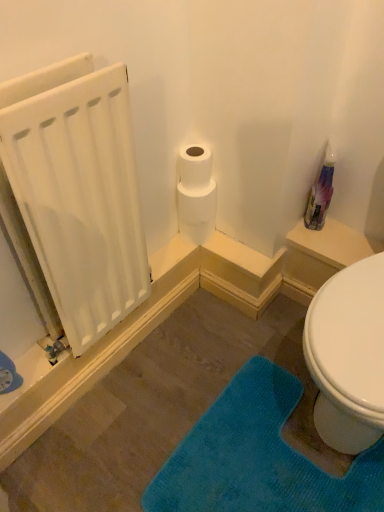
The width and height of the screenshot is (384, 512). Find the location of `teal plush bath mat at lower right`. teal plush bath mat at lower right is located at coordinates [258, 457].

Describe the element at coordinates (196, 211) in the screenshot. I see `white matte toilet paper at upper center` at that location.

Image resolution: width=384 pixels, height=512 pixels. What do you see at coordinates (80, 198) in the screenshot? I see `white matte radiator at left` at bounding box center [80, 198].

Image resolution: width=384 pixels, height=512 pixels. What are the coordinates of `teal plush bath mat at lower right` in the screenshot? It's located at (258, 457).

Who is shorter, teal plush bath mat at lower right or white matte radiator at left?

Standing shorter between the two is teal plush bath mat at lower right.

Is teal plush bath mat at lower right oriented away from white matte radiator at left?

teal plush bath mat at lower right does not have its back to white matte radiator at left.

Locate an element on the screen. Image resolution: width=384 pixels, height=512 pixels. radiator in front of the teal plush bath mat at lower right is located at coordinates (80, 198).

Is point (210, 424) closer to camera compared to point (132, 255)?

No.

Considering the sizes of objects translucent plastic spray bottle at upper right and white matte radiator at left in the image provided, who is taller, translucent plastic spray bottle at upper right or white matte radiator at left?

Standing taller between the two is white matte radiator at left.

Can you confirm if translucent plastic spray bottle at upper right is smaller than white matte radiator at left?

Yes.

Between translucent plastic spray bottle at upper right and white matte radiator at left, which one is positioned in front?

white matte radiator at left is more forward.

Is translucent plastic spray bottle at upper right placed right next to white matte radiator at left?

No, translucent plastic spray bottle at upper right is not touching white matte radiator at left.

Which is more distant, (x=86, y=161) or (x=320, y=218)?

The point (x=320, y=218) is farther from the camera.

From a real-world perspective, is white matte radiator at left on top of translucent plastic spray bottle at upper right?

Indeed, from a real-world perspective, white matte radiator at left stands above translucent plastic spray bottle at upper right.

Is white matte radiator at left bigger or smaller than translucent plastic spray bottle at upper right?

Considering their sizes, white matte radiator at left takes up more space than translucent plastic spray bottle at upper right.

Who is shorter, translucent plastic spray bottle at upper right or white matte toilet paper at upper center?

Standing shorter between the two is white matte toilet paper at upper center.

Is point (323, 192) closer or farther from the camera than point (204, 212)?

Point (323, 192) is positioned closer to the camera compared to point (204, 212).

Does translucent plastic spray bottle at upper right have a smaller size compared to white matte toilet paper at upper center?

Yes, translucent plastic spray bottle at upper right is smaller than white matte toilet paper at upper center.

From the image's perspective, is translucent plastic spray bottle at upper right beneath white matte toilet paper at upper center?

No, from the image's perspective, translucent plastic spray bottle at upper right is not beneath white matte toilet paper at upper center.

How different are the orientations of white matte radiator at left and white matte toilet paper at upper center in degrees?

The facing directions of white matte radiator at left and white matte toilet paper at upper center are 0.00369 degrees apart.

From a real-world perspective, is white matte radiator at left on top of white matte toilet paper at upper center?

Yes, from a real-world perspective, white matte radiator at left is above white matte toilet paper at upper center.

Is white matte radiator at left turned away from white matte toilet paper at upper center?

No, white matte radiator at left is not facing the opposite direction of white matte toilet paper at upper center.

Considering the points (49, 218) and (208, 222), which point is behind, point (49, 218) or point (208, 222)?

Positioned behind is point (208, 222).

Is white matte radiator at left taller or shorter than teal plush bath mat at lower right?

Clearly, white matte radiator at left is taller compared to teal plush bath mat at lower right.

Who is more distant, white matte radiator at left or teal plush bath mat at lower right?

Positioned behind is teal plush bath mat at lower right.

Considering the relative sizes of white matte radiator at left and teal plush bath mat at lower right in the image provided, is white matte radiator at left wider than teal plush bath mat at lower right?

Incorrect, the width of white matte radiator at left does not surpass that of teal plush bath mat at lower right.

Is white matte radiator at left positioned with its back to teal plush bath mat at lower right?

No, white matte radiator at left is not facing the opposite direction of teal plush bath mat at lower right.

From the image's perspective, which one is positioned higher, white matte toilet paper at upper center or teal plush bath mat at lower right?

white matte toilet paper at upper center, from the image's perspective.

Considering the sizes of white matte toilet paper at upper center and teal plush bath mat at lower right in the image, is white matte toilet paper at upper center wider or thinner than teal plush bath mat at lower right?

white matte toilet paper at upper center is thinner than teal plush bath mat at lower right.

Would you say teal plush bath mat at lower right is part of white matte toilet paper at upper center's contents?

No, teal plush bath mat at lower right is not inside white matte toilet paper at upper center.

Are white matte toilet paper at upper center and teal plush bath mat at lower right far apart?

That's not correct — white matte toilet paper at upper center is a little close to teal plush bath mat at lower right.

I want to click on bath mat on the right of the white matte radiator at left, so click(x=258, y=457).

You are a GUI agent. You are given a task and a screenshot of the screen. Output one action in this format:
    pyautogui.click(x=<x>, y=<y>)
    Task: Click on the cleaning product below the white matte radiator at left (from a real-world perspective)
    The image size is (384, 512).
    Given the screenshot: What is the action you would take?
    pyautogui.click(x=320, y=192)

Looking at this image, estimate the real-world distances between objects in this image. Which object is further from teal plush bath mat at lower right, white matte radiator at left or white matte toilet paper at upper center?

white matte toilet paper at upper center lies further to teal plush bath mat at lower right than the other object.

From the image, which object appears to be nearer to translucent plastic spray bottle at upper right, white matte radiator at left or teal plush bath mat at lower right?

Based on the image, teal plush bath mat at lower right appears to be nearer to translucent plastic spray bottle at upper right.

From the image, which object appears to be farther from white matte toilet paper at upper center, teal plush bath mat at lower right or white matte radiator at left?

Among the two, teal plush bath mat at lower right is located further to white matte toilet paper at upper center.

Based on their spatial positions, is white matte toilet paper at upper center or white matte radiator at left closer to teal plush bath mat at lower right?

white matte radiator at left lies closer to teal plush bath mat at lower right than the other object.

Considering their positions, is teal plush bath mat at lower right positioned further to white matte radiator at left than translucent plastic spray bottle at upper right?

Based on the image, translucent plastic spray bottle at upper right appears to be further to white matte radiator at left.

Estimate the real-world distances between objects in this image. Which object is closer to teal plush bath mat at lower right, translucent plastic spray bottle at upper right or white matte toilet paper at upper center?

Based on the image, white matte toilet paper at upper center appears to be nearer to teal plush bath mat at lower right.

Based on their spatial positions, is white matte radiator at left or translucent plastic spray bottle at upper right closer to teal plush bath mat at lower right?

white matte radiator at left.

Estimate the real-world distances between objects in this image. Which object is closer to white matte radiator at left, white matte toilet paper at upper center or translucent plastic spray bottle at upper right?

white matte toilet paper at upper center is closer to white matte radiator at left.

Find the location of `toilet paper between translucent plastic spray bottle at upper right and teal plush bath mat at lower right in the vertical direction`. toilet paper between translucent plastic spray bottle at upper right and teal plush bath mat at lower right in the vertical direction is located at coordinates (196, 211).

Where is `radiator between white matte toilet paper at upper center and teal plush bath mat at lower right vertically`? radiator between white matte toilet paper at upper center and teal plush bath mat at lower right vertically is located at coordinates (80, 198).

You are a GUI agent. You are given a task and a screenshot of the screen. Output one action in this format:
    pyautogui.click(x=<x>, y=<y>)
    Task: Click on the cleaning product between white matte radiator at left and white matte toilet paper at upper center along the z-axis
    The height and width of the screenshot is (512, 384).
    Given the screenshot: What is the action you would take?
    pyautogui.click(x=320, y=192)

Where is `radiator between translucent plastic spray bottle at upper right and teal plush bath mat at lower right in the up-down direction`? This screenshot has height=512, width=384. radiator between translucent plastic spray bottle at upper right and teal plush bath mat at lower right in the up-down direction is located at coordinates (80, 198).